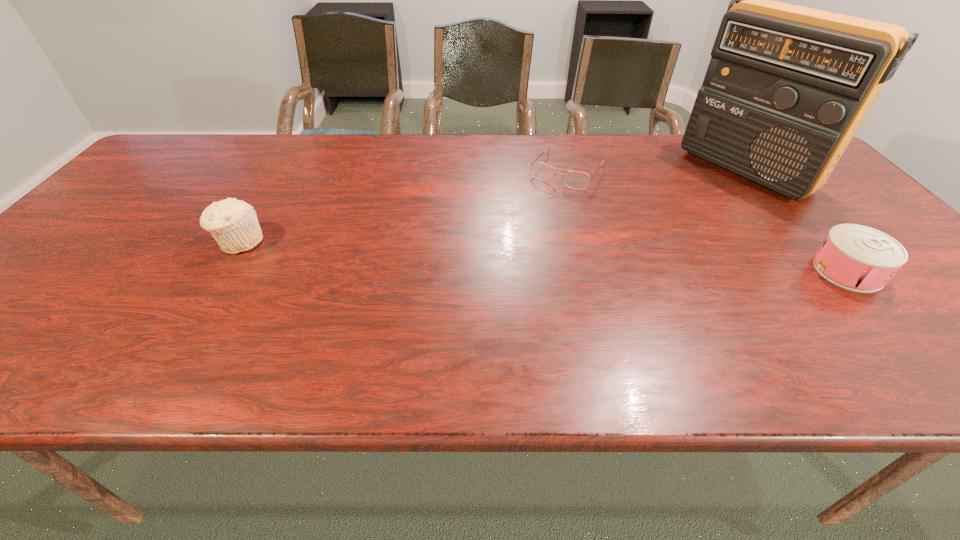
At what (x,y) coordinates should I click in order to perform the action: click on vacant area situated on the front-facing side of the third object from right to left. Please return your answer as a coordinate pair (x, y). Looking at the image, I should click on (541, 207).

Find the location of a particular element. Image resolution: width=960 pixels, height=540 pixels. vacant space located 0.330m on the front-facing side of the radio receiver is located at coordinates (637, 237).

Where is `free space located 0.290m on the front-facing side of the radio receiver`? This screenshot has height=540, width=960. free space located 0.290m on the front-facing side of the radio receiver is located at coordinates (648, 231).

The height and width of the screenshot is (540, 960). What are the coordinates of `free space located on the front-facing side of the radio receiver` in the screenshot? It's located at (676, 215).

Identify the location of spectacles at the far edge. (576, 180).

Find the location of a particular element. This screenshot has width=960, height=540. radio receiver that is positioned at the far edge is located at coordinates (787, 87).

I want to click on can at the right edge, so click(855, 257).

Find the location of a particular element. The image size is (960, 540). radio receiver positioned at the right edge is located at coordinates (787, 87).

Where is `object positioned at the far right corner`? This screenshot has width=960, height=540. object positioned at the far right corner is located at coordinates (787, 87).

In the image, there is a desktop. Where is `free space at the far edge`? This screenshot has height=540, width=960. free space at the far edge is located at coordinates (496, 148).